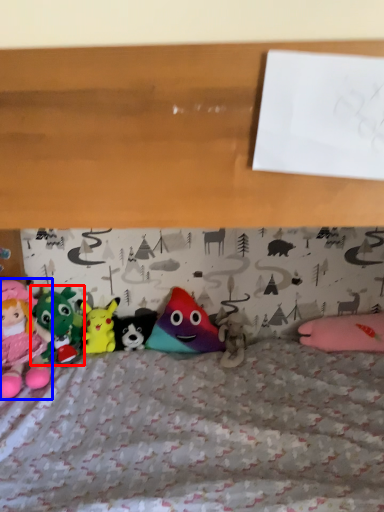
Question: Which point is closer to the camera, toy (highlighted by a red box) or toy (highlighted by a blue box)?

Choices:
 (A) toy
 (B) toy

Answer: (B)